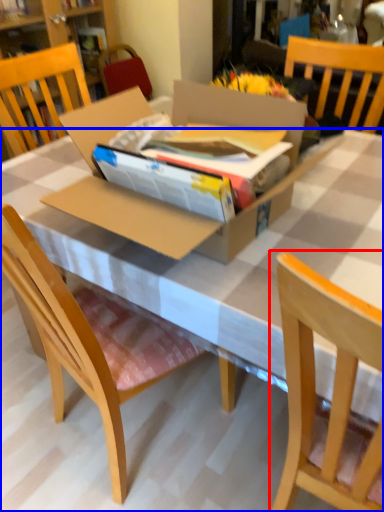
Question: Which object is closer to the camera taking this photo, chair (highlighted by a red box) or desk (highlighted by a blue box)?

Choices:
 (A) chair
 (B) desk

Answer: (A)